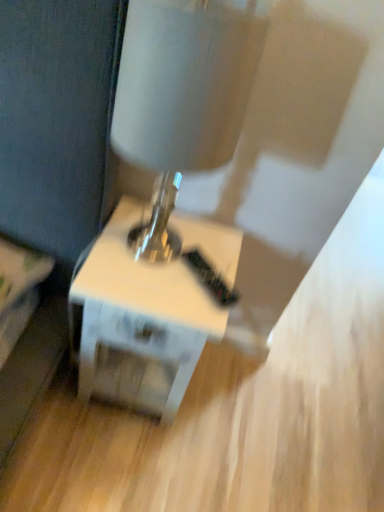
Question: Considering the positions of white glossy table at center and metallic silver table lamp at center in the image, is white glossy table at center taller or shorter than metallic silver table lamp at center?

Choices:
 (A) short
 (B) tall

Answer: (A)

Question: Visually, is white glossy table at center positioned to the left or to the right of metallic silver table lamp at center?

Choices:
 (A) left
 (B) right

Answer: (A)

Question: Is white glossy table at center inside the boundaries of metallic silver table lamp at center, or outside?

Choices:
 (A) outside
 (B) inside

Answer: (A)

Question: Considering the positions of metallic silver table lamp at center and white glossy table at center in the image, is metallic silver table lamp at center taller or shorter than white glossy table at center?

Choices:
 (A) tall
 (B) short

Answer: (A)

Question: Considering the relative positions of metallic silver table lamp at center and white glossy table at center in the image provided, is metallic silver table lamp at center to the left or to the right of white glossy table at center?

Choices:
 (A) right
 (B) left

Answer: (A)

Question: Is point (137, 113) positioned closer to the camera than point (109, 388)?

Choices:
 (A) closer
 (B) farther

Answer: (A)

Question: From a real-world perspective, is metallic silver table lamp at center positioned above or below white glossy table at center?

Choices:
 (A) above
 (B) below

Answer: (A)